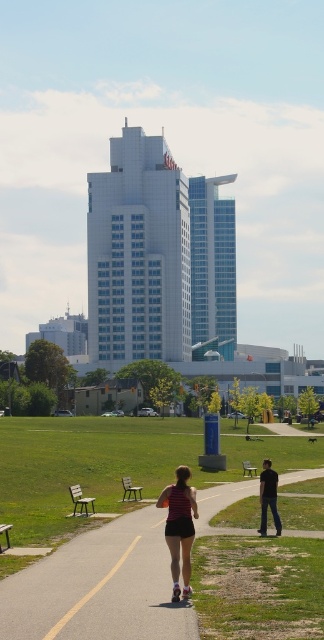
Question: Among these objects, which one is farthest from the camera?

Choices:
 (A) black smooth pants at lower right
 (B) wooden park bench at center
 (C) asphalt path at center
 (D) red fabric shorts at center

Answer: (B)

Question: Can you confirm if asphalt path at center is wider than wooden park bench at lower left?

Choices:
 (A) no
 (B) yes

Answer: (B)

Question: Which point appears closest to the camera in this image?

Choices:
 (A) (187, 582)
 (B) (87, 508)
 (C) (170, 636)
 (D) (264, 483)

Answer: (C)

Question: Considering the relative positions of asphalt path at center and wooden park bench at lower left in the image provided, where is asphalt path at center located with respect to wooden park bench at lower left?

Choices:
 (A) left
 (B) right

Answer: (B)

Question: Among these points, which one is nearest to the camera?

Choices:
 (A) (34, 625)
 (B) (269, 468)
 (C) (165, 486)

Answer: (A)

Question: Does red fabric shorts at center come behind black smooth pants at lower right?

Choices:
 (A) no
 (B) yes

Answer: (A)